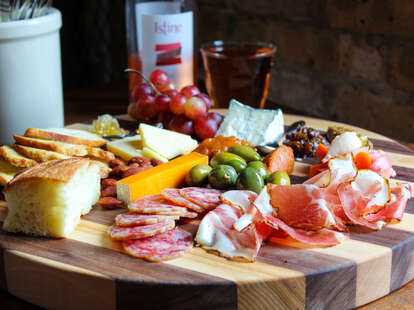
Find the location of a particular element. This screenshot has height=310, width=414. ceramic container is located at coordinates (36, 64).